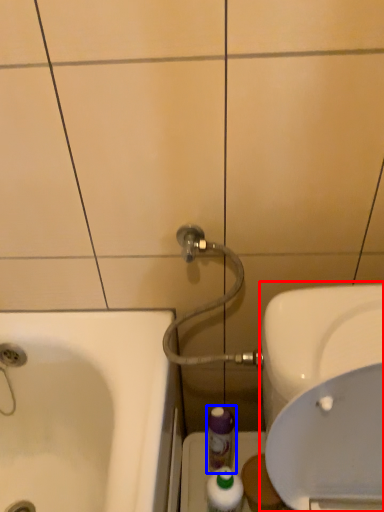
Question: Which point is closer to the camera, sink (highlighted by a red box) or mouthwash (highlighted by a blue box)?

Choices:
 (A) sink
 (B) mouthwash

Answer: (A)